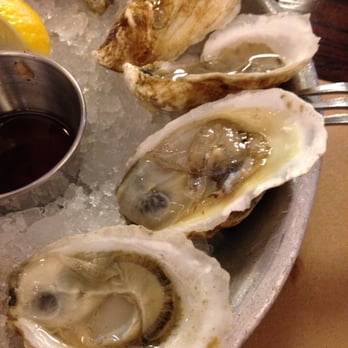
The height and width of the screenshot is (348, 348). Find the location of `plate`. plate is located at coordinates 277,252.